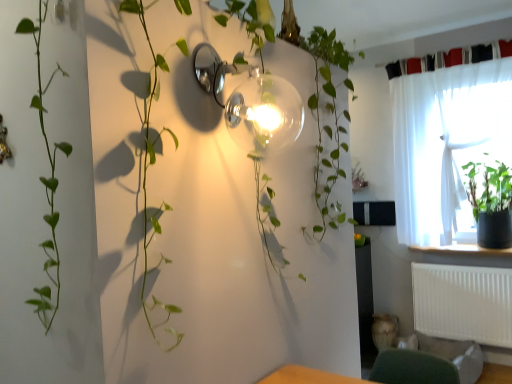
Describe the element at coordinates (490, 203) in the screenshot. This screenshot has width=512, height=384. I see `green matte plant at right` at that location.

Describe the element at coordinates (450, 142) in the screenshot. I see `white sheer curtain at upper right, which is the 1th curtain from bottom to top` at that location.

What do you see at coordinates (464, 250) in the screenshot?
I see `white glossy window sill at right` at bounding box center [464, 250].

Find the location of a particular element. This screenshot has height=384, width=512. green matte plant at right is located at coordinates coord(490,203).

Is white sheer curtain at upper right, which ranks as the 2th curtain in top-to-bottom order, inside the boundaries of clear glass globe at upper center, or outside?

white sheer curtain at upper right, which ranks as the 2th curtain in top-to-bottom order, is spatially situated outside clear glass globe at upper center.

This screenshot has height=384, width=512. Find the location of `light fixture lying above the white sheer curtain at upper right, which ranks as the 2th curtain in top-to-bottom order (from the image's perspective)`. light fixture lying above the white sheer curtain at upper right, which ranks as the 2th curtain in top-to-bottom order (from the image's perspective) is located at coordinates (252, 103).

From a real-world perspective, is white sheer curtain at upper right, which is the 1th curtain from bottom to top, physically located above or below clear glass globe at upper center?

In terms of real-world spatial position, white sheer curtain at upper right, which is the 1th curtain from bottom to top, is below clear glass globe at upper center.

Can you confirm if white sheer curtain at upper right, which is the 1th curtain from bottom to top, is bigger than clear glass globe at upper center?

Yes.

Is white plastic radiator at lower right to the right of green matte plant at right from the viewer's perspective?

In fact, white plastic radiator at lower right is to the left of green matte plant at right.

How different are the orientations of white plastic radiator at lower right and green matte plant at right in degrees?

The angle between the facing direction of white plastic radiator at lower right and the facing direction of green matte plant at right is 1.01 degrees.

Between white plastic radiator at lower right and green matte plant at right, which one has smaller width?

Thinner between the two is white plastic radiator at lower right.

Consider the image. From a real-world perspective, is white plastic radiator at lower right physically above green matte plant at right?

No, from a real-world perspective, white plastic radiator at lower right is not above green matte plant at right.

Considering the relative positions of white glossy window sill at right and green fabric swivel chair at lower right in the image provided, is white glossy window sill at right to the left or to the right of green fabric swivel chair at lower right?

white glossy window sill at right is positioned on green fabric swivel chair at lower right's right side.

Which of these two, white glossy window sill at right or green fabric swivel chair at lower right, is bigger?

Bigger between the two is green fabric swivel chair at lower right.

From the image's perspective, is white glossy window sill at right beneath green fabric swivel chair at lower right?

No, from the image's perspective, white glossy window sill at right is not beneath green fabric swivel chair at lower right.

Is white glossy window sill at right positioned with its back to green fabric swivel chair at lower right?

No.

From the image's perspective, is white glossy window sill at right on top of green matte plant at right?

No.

Identify the location of houseplant to the right of white glossy window sill at right. The image size is (512, 384). (490, 203).

Considering the relative positions of white glossy window sill at right and green matte plant at right in the image provided, is white glossy window sill at right to the right of green matte plant at right from the viewer's perspective?

No, white glossy window sill at right is not to the right of green matte plant at right.

In terms of size, does white glossy window sill at right appear bigger or smaller than green matte plant at right?

Clearly, white glossy window sill at right is smaller in size than green matte plant at right.

From a real-world perspective, who is located lower, white glossy window sill at right or black fabric curtain at upper right, which ranks as the second curtain in bottom-to-top order?

In real-world perspective, white glossy window sill at right is lower.

Who is smaller, white glossy window sill at right or black fabric curtain at upper right, which is counted as the first curtain, starting from the top?

Smaller between the two is black fabric curtain at upper right, which is counted as the first curtain, starting from the top.

Measure the distance between white glossy window sill at right and black fabric curtain at upper right, which is counted as the first curtain, starting from the top.

white glossy window sill at right is 4.85 feet away from black fabric curtain at upper right, which is counted as the first curtain, starting from the top.

What's the angular difference between white glossy window sill at right and black fabric curtain at upper right, which is counted as the first curtain, starting from the top,'s facing directions?

The facing directions of white glossy window sill at right and black fabric curtain at upper right, which is counted as the first curtain, starting from the top, are 0.101 degrees apart.

Is green fabric swivel chair at lower right wider than white sheer curtain at upper right, which is the 1th curtain from bottom to top?

Correct, the width of green fabric swivel chair at lower right exceeds that of white sheer curtain at upper right, which is the 1th curtain from bottom to top.

Is green fabric swivel chair at lower right situated inside white sheer curtain at upper right, which is the 1th curtain from bottom to top, or outside?

green fabric swivel chair at lower right is outside white sheer curtain at upper right, which is the 1th curtain from bottom to top.

Are green fabric swivel chair at lower right and white sheer curtain at upper right, which is the 1th curtain from bottom to top, located far from each other?

That's right, there is a large distance between green fabric swivel chair at lower right and white sheer curtain at upper right, which is the 1th curtain from bottom to top.

From the picture: Is green fabric swivel chair at lower right looking in the opposite direction of white sheer curtain at upper right, which ranks as the 2th curtain in top-to-bottom order?

No, white sheer curtain at upper right, which ranks as the 2th curtain in top-to-bottom order, is not at the back of green fabric swivel chair at lower right.

Is white sheer curtain at upper right, which ranks as the 2th curtain in top-to-bottom order, taller than green matte plant at right?

Correct, white sheer curtain at upper right, which ranks as the 2th curtain in top-to-bottom order, is much taller as green matte plant at right.

Is white sheer curtain at upper right, which is the 1th curtain from bottom to top, thinner than green matte plant at right?

Correct, the width of white sheer curtain at upper right, which is the 1th curtain from bottom to top, is less than that of green matte plant at right.

Is the surface of white sheer curtain at upper right, which is the 1th curtain from bottom to top, in direct contact with green matte plant at right?

No, white sheer curtain at upper right, which is the 1th curtain from bottom to top, is not in contact with green matte plant at right.

Considering the positions of points (504, 85) and (481, 195), is point (504, 85) closer to camera compared to point (481, 195)?

Yes.

At what (x,y) coordinates should I click in order to perform the action: click on light fixture above the white sheer curtain at upper right, which is the 1th curtain from bottom to top (from a real-world perspective). Please return your answer as a coordinate pair (x, y). Looking at the image, I should click on (252, 103).

You are a GUI agent. You are given a task and a screenshot of the screen. Output one action in this format:
    pyautogui.click(x=<x>, y=<y>)
    Task: Click on the radiator that is on the left side of green matte plant at right
    Image resolution: width=512 pixels, height=384 pixels.
    Given the screenshot: What is the action you would take?
    pyautogui.click(x=463, y=303)

Looking at this image, from the image, which object appears to be nearer to white sheer curtain at upper right, which is the 1th curtain from bottom to top, black fabric curtain at upper right, which ranks as the second curtain in bottom-to-top order, or white plastic radiator at lower right?

black fabric curtain at upper right, which ranks as the second curtain in bottom-to-top order.

Based on their spatial positions, is white sheer curtain at upper right, which is the 1th curtain from bottom to top, or white glossy window sill at right closer to green fabric swivel chair at lower right?

The object closer to green fabric swivel chair at lower right is white glossy window sill at right.

Based on their spatial positions, is green matte plant at right or white plastic radiator at lower right further from white glossy window sill at right?

The object further to white glossy window sill at right is white plastic radiator at lower right.

When comparing their distances from green matte plant at right, does black fabric curtain at upper right, which is counted as the first curtain, starting from the top, or white glossy window sill at right seem closer?

white glossy window sill at right is positioned closer to the anchor green matte plant at right.

Looking at this image, which object lies nearer to the anchor point white plastic radiator at lower right, green matte plant at right or white sheer curtain at upper right, which ranks as the 2th curtain in top-to-bottom order?

green matte plant at right is closer to white plastic radiator at lower right.

Looking at this image, based on their spatial positions, is green matte plant at right or clear glass globe at upper center further from white glossy window sill at right?

The object further to white glossy window sill at right is clear glass globe at upper center.

Which object lies further to the anchor point white plastic radiator at lower right, white glossy window sill at right or clear glass globe at upper center?

clear glass globe at upper center lies further to white plastic radiator at lower right than the other object.

Considering their positions, is white glossy window sill at right positioned further to white plastic radiator at lower right than black fabric curtain at upper right, which ranks as the second curtain in bottom-to-top order?

The object further to white plastic radiator at lower right is black fabric curtain at upper right, which ranks as the second curtain in bottom-to-top order.

Identify the location of houseplant between black fabric curtain at upper right, which ranks as the second curtain in bottom-to-top order, and white glossy window sill at right vertically. (490, 203).

You are a GUI agent. You are given a task and a screenshot of the screen. Output one action in this format:
    pyautogui.click(x=<x>, y=<y>)
    Task: Click on the radiator between black fabric curtain at upper right, which is counted as the first curtain, starting from the top, and green fabric swivel chair at lower right in the up-down direction
    This screenshot has width=512, height=384.
    Given the screenshot: What is the action you would take?
    pyautogui.click(x=463, y=303)

The width and height of the screenshot is (512, 384). Identify the location of houseplant between black fabric curtain at upper right, which is counted as the first curtain, starting from the top, and white plastic radiator at lower right vertically. (490, 203).

This screenshot has width=512, height=384. Identify the location of window sill between white sheer curtain at upper right, which ranks as the 2th curtain in top-to-bottom order, and white plastic radiator at lower right vertically. (464, 250).